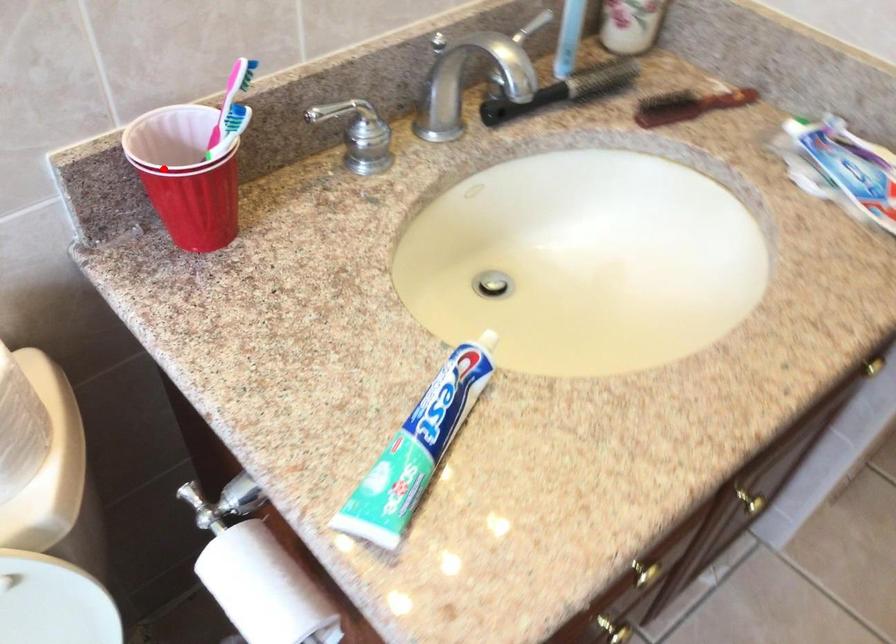
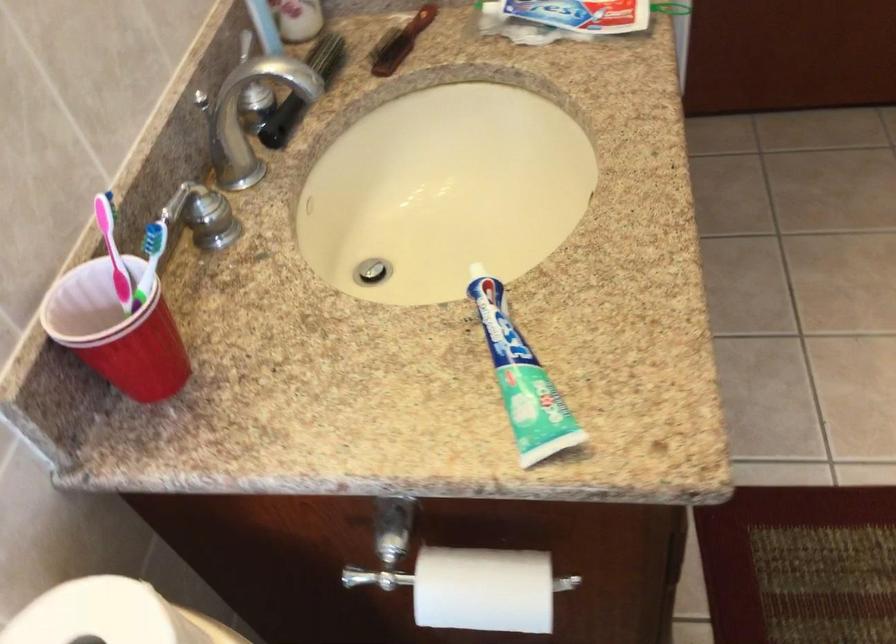
The point at the highlighted location is marked in the first image. Where is the corresponding point in the second image?

(116, 330)